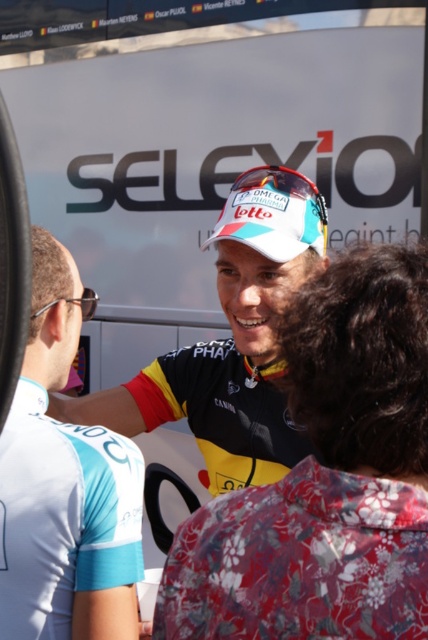
Question: Which is nearer to the black jersey at center?

Choices:
 (A) teal jersey at center
 (B) yellow and black jersey at center

Answer: (A)

Question: Is black jersey at center thinner than yellow and black jersey at center?

Choices:
 (A) no
 (B) yes

Answer: (B)

Question: Which point is closer to the camera?

Choices:
 (A) teal jersey at center
 (B) black rubber tire at left
 (C) yellow and black jersey at center
 (D) black jersey at center

Answer: (B)

Question: Does black jersey at center have a smaller size compared to clear plastic glasses at left?

Choices:
 (A) no
 (B) yes

Answer: (A)

Question: Can you confirm if teal jersey at center is thinner than yellow and black jersey at center?

Choices:
 (A) yes
 (B) no

Answer: (A)

Question: Which object is positioned closest to the clear plastic glasses at left?

Choices:
 (A) black rubber tire at left
 (B) yellow and black jersey at center
 (C) black jersey at center

Answer: (B)